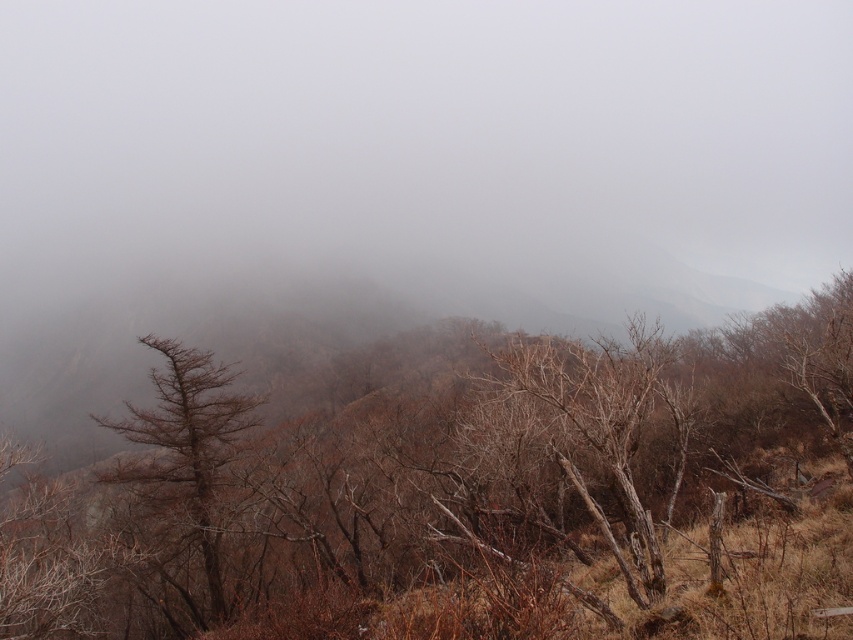
Based on the scene description, which brown matte tree is larger in size between the brown matte tree at center and the brown matte tree at left?

The brown matte tree at center is bigger than the brown matte tree at left according to the description.

You are standing at point A and want to walk to point B. The coordinates of point A are point A at (454, 356) and point B are point B at (170, 380). Considering the misty mountain terrain, which direction should you move to reach point B from point A?

To reach point B at (170, 380) from point A at (454, 356), you should move downward and to the right. Since point A is behind point B in the image, moving towards the foreground direction would bring you closer to point B.